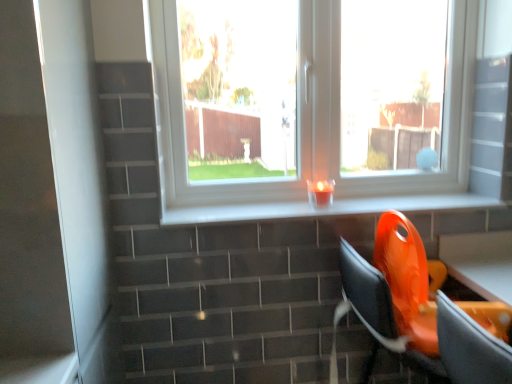
Image resolution: width=512 pixels, height=384 pixels. In order to click on white glossy window sill at center in this screenshot , I will do `click(325, 209)`.

Measure the distance between white glossy window sill at center and camera.

The depth of white glossy window sill at center is 4.45 feet.

Find the location of a particular element. This screenshot has width=512, height=384. translucent glass candle at center is located at coordinates (320, 193).

What do you see at coordinates (375, 317) in the screenshot?
I see `orange plastic chair at lower right` at bounding box center [375, 317].

Locate an element on the screen. orange plastic chair at lower right is located at coordinates (375, 317).

Where is `transparent glass window at center`? The width and height of the screenshot is (512, 384). transparent glass window at center is located at coordinates (317, 128).

Is translucent glass candle at center to the left or to the right of orange plastic chair at lower right in the image?

Based on their positions, translucent glass candle at center is located to the left of orange plastic chair at lower right.

Choose the correct answer: Is translucent glass candle at center inside orange plastic chair at lower right or outside it?

translucent glass candle at center is not inside orange plastic chair at lower right, it's outside.

Which object is further away from the camera, translucent glass candle at center or orange plastic chair at lower right?

translucent glass candle at center is more distant.

Are translucent glass candle at center and orange plastic chair at lower right far apart?

Actually, translucent glass candle at center and orange plastic chair at lower right are a little close together.

Are transparent glass window at center and translucent glass candle at center located far from each other?

That's not correct — transparent glass window at center is a little close to translucent glass candle at center.

Based on their positions, is transparent glass window at center located to the left or right of translucent glass candle at center?

transparent glass window at center is positioned on translucent glass candle at center's right side.

Is transparent glass window at center not inside translucent glass candle at center?

Yes, transparent glass window at center is not within translucent glass candle at center.

Looking at this image, from a real-world perspective, is white glossy window sill at center positioned over orange plastic chair at lower right based on gravity?

Correct, in the physical world, white glossy window sill at center is higher than orange plastic chair at lower right.

In the scene shown: Can you confirm if white glossy window sill at center is positioned to the right of orange plastic chair at lower right?

In fact, white glossy window sill at center is to the left of orange plastic chair at lower right.

Does point (167, 214) come farther from viewer compared to point (353, 264)?

Yes, point (167, 214) is farther from viewer.

Who is bigger, white glossy window sill at center or orange plastic chair at lower right?

orange plastic chair at lower right.

Relative to translucent glass candle at center, is white glossy window sill at center in front or behind?

white glossy window sill at center is in front of translucent glass candle at center.

Considering the positions of points (303, 216) and (323, 181), is point (303, 216) closer to camera compared to point (323, 181)?

Yes, it is.

Considering the sizes of white glossy window sill at center and translucent glass candle at center in the image, is white glossy window sill at center bigger or smaller than translucent glass candle at center?

In the image, white glossy window sill at center appears to be larger than translucent glass candle at center.

From a real-world perspective, between white glossy window sill at center and translucent glass candle at center, who is vertically lower?

white glossy window sill at center is physically lower.

Between white glossy screen door at left and translucent glass candle at center, which one has smaller size?

translucent glass candle at center is smaller.

From the image's perspective, is white glossy screen door at left below translucent glass candle at center?

Correct, white glossy screen door at left appears lower than translucent glass candle at center in the image.

Is point (20, 339) positioned behind point (325, 208)?

No, (20, 339) is in front of (325, 208).

Looking at this image, considering the sizes of objects white glossy screen door at left and translucent glass candle at center in the image provided, who is shorter, white glossy screen door at left or translucent glass candle at center?

translucent glass candle at center.

From the image's perspective, is orange plastic swivel chair at lower right located above or below translucent glass candle at center?

orange plastic swivel chair at lower right is situated lower than translucent glass candle at center in the image.

Which of these two, orange plastic swivel chair at lower right or translucent glass candle at center, is bigger?

orange plastic swivel chair at lower right is bigger.

Is orange plastic swivel chair at lower right further to the viewer compared to translucent glass candle at center?

No, orange plastic swivel chair at lower right is closer to the camera.

Between orange plastic swivel chair at lower right and translucent glass candle at center, which one appears on the left side from the viewer's perspective?

translucent glass candle at center is more to the left.

Does transparent glass window at center have a larger size compared to white glossy screen door at left?

Incorrect, transparent glass window at center is not larger than white glossy screen door at left.

Which is in front, point (458, 157) or point (38, 130)?

Positioned in front is point (38, 130).

Can you confirm if transparent glass window at center is thinner than white glossy screen door at left?

Correct, the width of transparent glass window at center is less than that of white glossy screen door at left.

Between transparent glass window at center and white glossy screen door at left, which one appears on the right side from the viewer's perspective?

From the viewer's perspective, transparent glass window at center appears more on the right side.

In order to click on candle holder above the orange plastic chair at lower right (from the image's perspective) in this screenshot , I will do `click(320, 193)`.

This screenshot has height=384, width=512. In order to click on window located above the translucent glass candle at center (from a real-world perspective) in this screenshot , I will do `click(317, 128)`.

Estimate the real-world distances between objects in this image. Which object is closer to white glossy window sill at center, transparent glass window at center or orange plastic swivel chair at lower right?

Based on the image, transparent glass window at center appears to be nearer to white glossy window sill at center.

From the image, which object appears to be nearer to orange plastic swivel chair at lower right, transparent glass window at center or translucent glass candle at center?

The object closer to orange plastic swivel chair at lower right is translucent glass candle at center.

From the image, which object appears to be farther from white glossy screen door at left, orange plastic chair at lower right or orange plastic swivel chair at lower right?

orange plastic swivel chair at lower right is further to white glossy screen door at left.

Based on their spatial positions, is white glossy window sill at center or orange plastic chair at lower right further from transparent glass window at center?

orange plastic chair at lower right is positioned further to the anchor transparent glass window at center.

Based on their spatial positions, is transparent glass window at center or orange plastic chair at lower right closer to white glossy window sill at center?

Based on the image, transparent glass window at center appears to be nearer to white glossy window sill at center.

Considering their positions, is orange plastic chair at lower right positioned further to white glossy window sill at center than orange plastic swivel chair at lower right?

orange plastic chair at lower right lies further to white glossy window sill at center than the other object.

Considering their positions, is white glossy window sill at center positioned further to orange plastic swivel chair at lower right than transparent glass window at center?

The object further to orange plastic swivel chair at lower right is transparent glass window at center.

From the image, which object appears to be nearer to transparent glass window at center, orange plastic chair at lower right or orange plastic swivel chair at lower right?

orange plastic swivel chair at lower right lies closer to transparent glass window at center than the other object.

Image resolution: width=512 pixels, height=384 pixels. In order to click on candle holder that lies between transparent glass window at center and white glossy window sill at center from top to bottom in this screenshot , I will do `click(320, 193)`.

Locate an element on the screen. Image resolution: width=512 pixels, height=384 pixels. window sill located between orange plastic swivel chair at lower right and translucent glass candle at center in the depth direction is located at coordinates (325, 209).

The width and height of the screenshot is (512, 384). Identify the location of window located between white glossy screen door at left and orange plastic swivel chair at lower right in the left-right direction. (317, 128).

At what (x,y) coordinates should I click in order to perform the action: click on candle holder between white glossy screen door at left and transparent glass window at center from left to right. Please return your answer as a coordinate pair (x, y). This screenshot has width=512, height=384. Looking at the image, I should click on (320, 193).